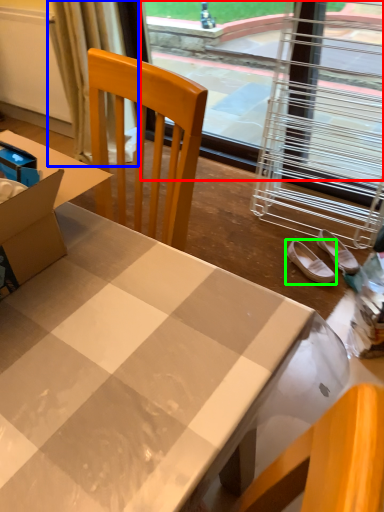
Question: Which is farther away from window screen (highlighted by a red box)? curtain (highlighted by a blue box) or footwear (highlighted by a green box)?

Choices:
 (A) curtain
 (B) footwear

Answer: (B)